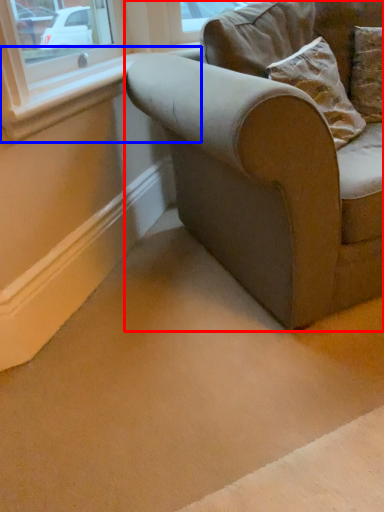
Question: Which object appears closest to the camera in this image, studio couch (highlighted by a red box) or window sill (highlighted by a blue box)?

Choices:
 (A) studio couch
 (B) window sill

Answer: (A)